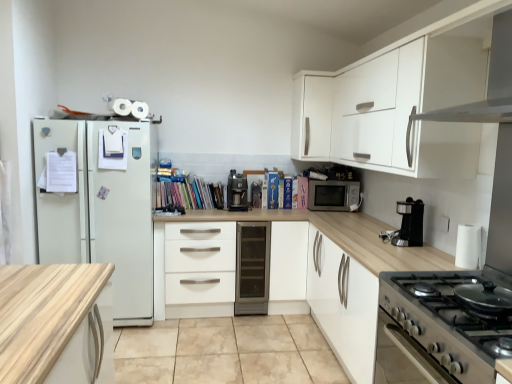
In order to click on space that is in front of white matte drawer at center in this screenshot , I will do `click(186, 339)`.